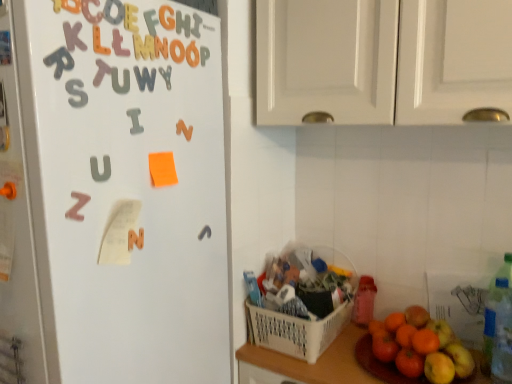
Question: Is orange paper at upper center outside white magnetic letters at left?

Choices:
 (A) yes
 (B) no

Answer: (B)

Question: From the image's perspective, would you say orange paper at upper center is shown under white magnetic letters at left?

Choices:
 (A) no
 (B) yes

Answer: (A)

Question: From the image's perspective, is orange paper at upper center on top of white magnetic letters at left?

Choices:
 (A) yes
 (B) no

Answer: (A)

Question: Does orange paper at upper center have a greater height compared to white magnetic letters at left?

Choices:
 (A) no
 (B) yes

Answer: (A)

Question: Considering the relative positions of orange paper at upper center and white magnetic letters at left in the image provided, is orange paper at upper center to the left of white magnetic letters at left from the viewer's perspective?

Choices:
 (A) no
 (B) yes

Answer: (A)

Question: Can you confirm if orange paper at upper center is bigger than white magnetic letters at left?

Choices:
 (A) no
 (B) yes

Answer: (A)

Question: Is pink matte letter z at left, arranged as the first alphabet when viewed from the left, to the right of white plastic basket at lower center from the viewer's perspective?

Choices:
 (A) no
 (B) yes

Answer: (A)

Question: From a real-world perspective, is pink matte letter z at left, which is counted as the 7th alphabet, starting from the top, physically below white plastic basket at lower center?

Choices:
 (A) yes
 (B) no

Answer: (B)

Question: From the image's perspective, is pink matte letter z at left, arranged as the first alphabet when viewed from the left, on white plastic basket at lower center?

Choices:
 (A) no
 (B) yes

Answer: (B)

Question: Is pink matte letter z at left, arranged as the first alphabet when viewed from the left, not within white plastic basket at lower center?

Choices:
 (A) yes
 (B) no

Answer: (A)

Question: Does pink matte letter z at left, which is the seventh alphabet from right to left, have a lesser height compared to white plastic basket at lower center?

Choices:
 (A) yes
 (B) no

Answer: (A)

Question: From a real-world perspective, is pink matte letter z at left, which is the seventh alphabet from right to left, over white plastic basket at lower center?

Choices:
 (A) no
 (B) yes

Answer: (B)

Question: Is pink matte letter z at left, which appears as the first alphabet when ordered from the bottom, at the right side of white matte cabinet doors at upper center?

Choices:
 (A) yes
 (B) no

Answer: (B)